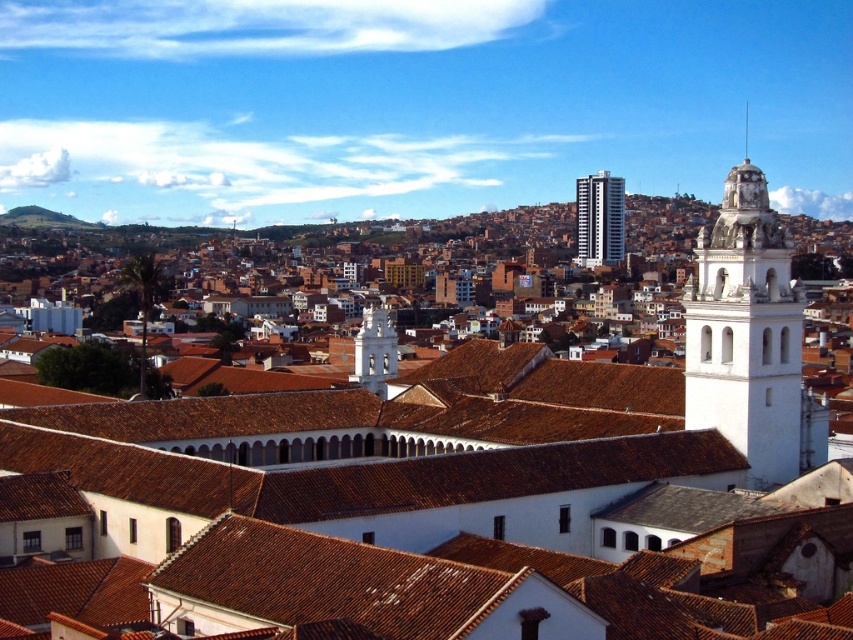
You are standing in the cityscape and want to take a photo that includes both point (715, 465) and point (751, 220). Which point should you position closer to the front of your camera frame to ensure both are in focus?

You should position point (715, 465) closer to the front of your camera frame because it is closer to the camera than point (751, 220), ensuring both are in focus.

In the scene shown: You are an architect analyzing the cityscape. You observe the white matte church tower at upper right and the white smooth spire at upper right. Which structure appears closer to you based on their positions in the image?

The white matte church tower at upper right appears closer to the viewer than the white smooth spire at upper right because it is positioned in front of the spire in the image.